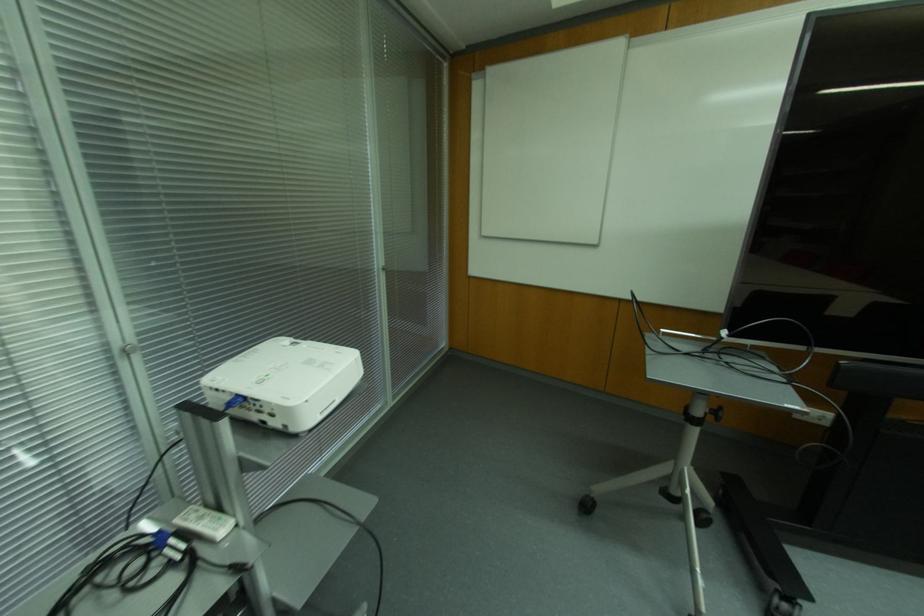
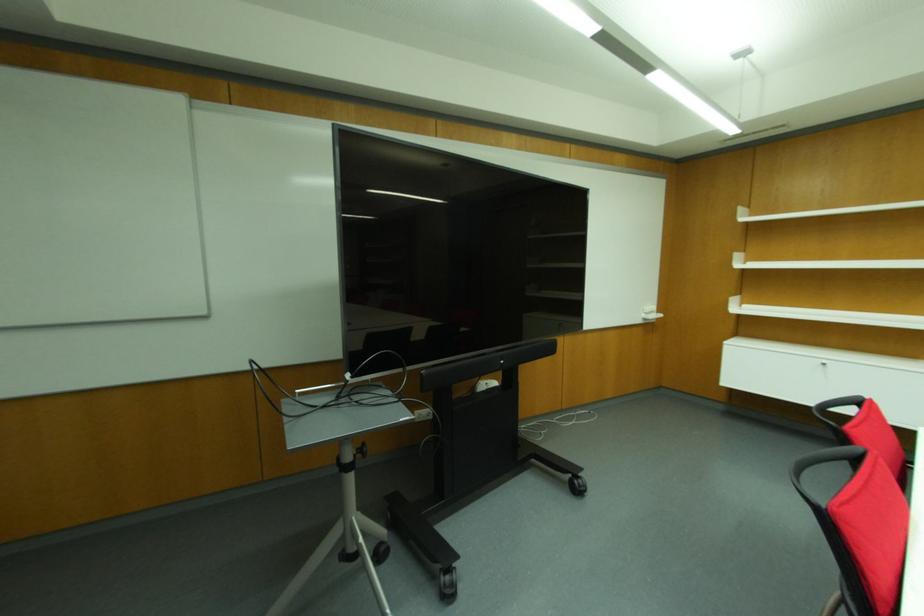
Question: The camera is either moving clockwise (left) or counter-clockwise (right) around the object. The first image is from the beginning of the video and the second image is from the end. Is the camera moving left or right when shooting the video?

Choices:
 (A) Left
 (B) Right

Answer: (A)